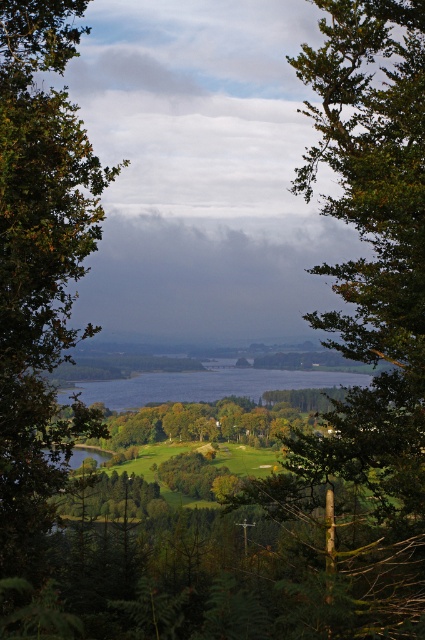
Question: Does green leafy tree at left have a larger size compared to clear water at center?

Choices:
 (A) yes
 (B) no

Answer: (A)

Question: Which point is farther to the camera?

Choices:
 (A) (25, 264)
 (B) (217, 394)

Answer: (B)

Question: Which point is farther from the camera taking this photo?

Choices:
 (A) (22, 236)
 (B) (121, 380)

Answer: (B)

Question: Is green leafy tree at left thinner than clear water at center?

Choices:
 (A) no
 (B) yes

Answer: (B)

Question: Is green leafy tree at left in front of clear water at center?

Choices:
 (A) yes
 (B) no

Answer: (A)